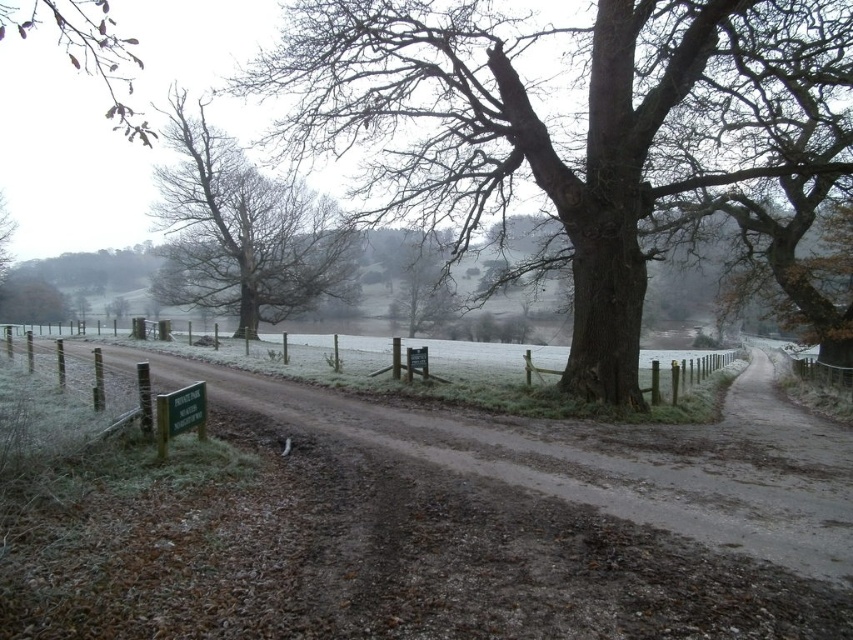
Question: Where is brown dirt track at center located in relation to brown rough bark tree at center in the image?

Choices:
 (A) below
 (B) above

Answer: (A)

Question: Among these objects, which one is nearest to the camera?

Choices:
 (A) brown rough bark tree at center
 (B) brown dirt track at center
 (C) smooth brown tree at center
 (D) wooden fence at center

Answer: (B)

Question: Is brown rough bark tree at center to the left of bare wood tree at upper left from the viewer's perspective?

Choices:
 (A) no
 (B) yes

Answer: (A)

Question: Which object appears farthest from the camera in this image?

Choices:
 (A) bare wood tree at upper left
 (B) smooth brown tree at center
 (C) wooden fence at center

Answer: (B)

Question: Is brown dirt track at center bigger than brown rough bark tree at center?

Choices:
 (A) yes
 (B) no

Answer: (B)

Question: Which point is farther to the camera?

Choices:
 (A) brown rough bark tree at center
 (B) bare wood tree at upper left
 (C) wooden fence at center

Answer: (B)